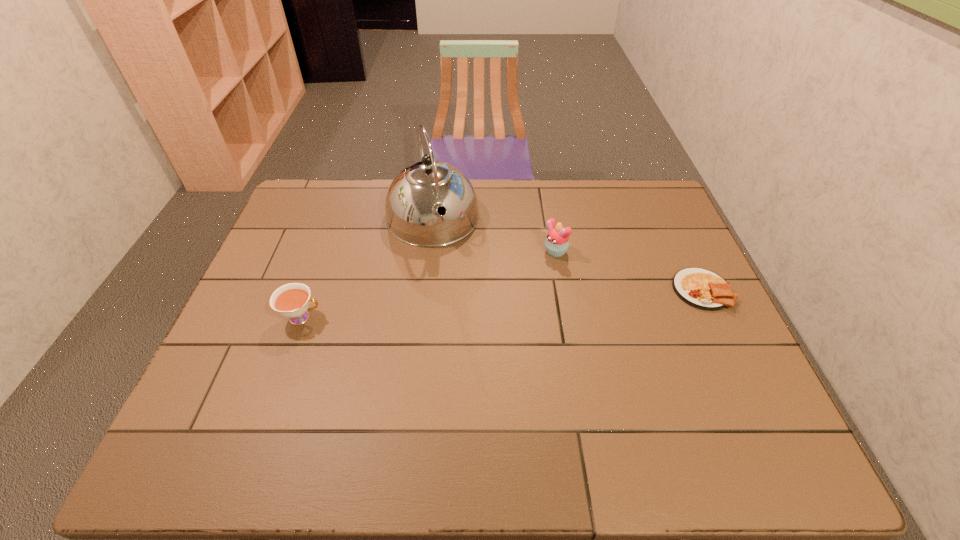
The image size is (960, 540). In order to click on empty location between the third object from right to left and the second tallest object in this screenshot , I will do `click(493, 236)`.

Where is `free space that is in between the rightmost object and the third object from left to right`? Image resolution: width=960 pixels, height=540 pixels. free space that is in between the rightmost object and the third object from left to right is located at coordinates (628, 272).

You are a GUI agent. You are given a task and a screenshot of the screen. Output one action in this format:
    pyautogui.click(x=<x>, y=<y>)
    Task: Click on the blank region between the second object from right to left and the kettle
    The width and height of the screenshot is (960, 540).
    Given the screenshot: What is the action you would take?
    pyautogui.click(x=493, y=236)

You are a GUI agent. You are given a task and a screenshot of the screen. Output one action in this format:
    pyautogui.click(x=<x>, y=<y>)
    Task: Click on the vacant space that is in between the second object from right to left and the omelet
    The width and height of the screenshot is (960, 540).
    Given the screenshot: What is the action you would take?
    pyautogui.click(x=628, y=272)

Where is `object that is the third closest to the tallest object`? This screenshot has width=960, height=540. object that is the third closest to the tallest object is located at coordinates (700, 288).

I want to click on the second closest object relative to the third tallest object, so click(x=557, y=241).